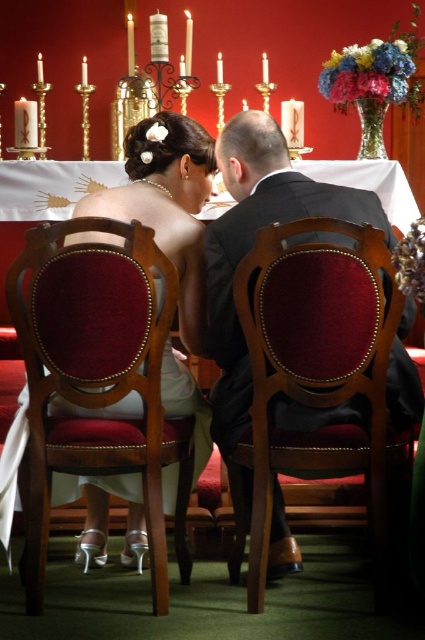
In the scene shown: You are a photographer setting up for the wedding photos. You need to ensure that the satin white dress at center is visible above the velvet red chair at center in the final shot. Based on their heights, is this possible?

The velvet red chair at center has a greater height compared to the satin white dress at center. Therefore, the satin white dress at center may not be fully visible above the velvet red chair at center due to the chair being taller.

You are a photographer standing at the camera position. You want to take a closeup shot of the velvet red chair at left without moving the camera. Is it possible to do so given its distance?

The velvet red chair at left is 6.13 feet away from camera, so yes, it is possible to take a closeup shot without moving the camera as this distance allows for clear focus and detail capture.